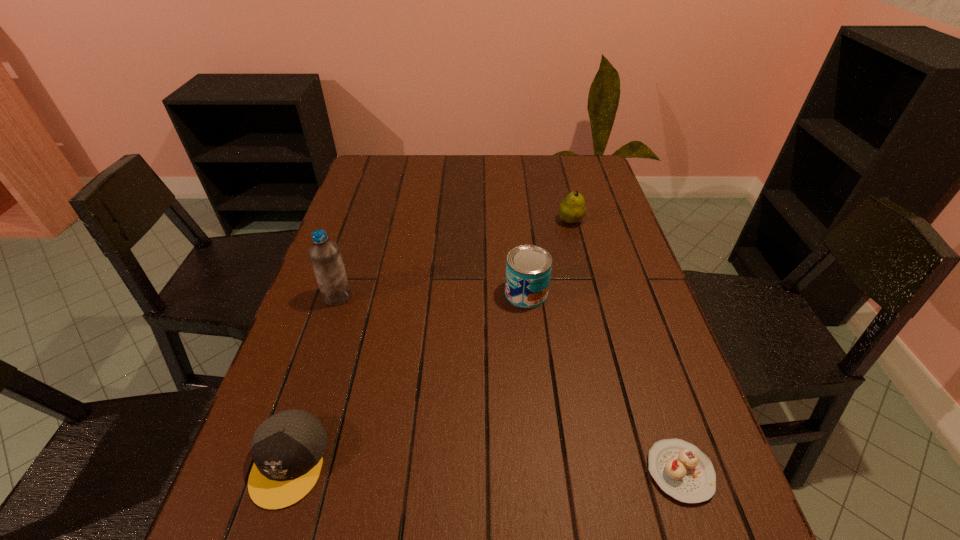
This screenshot has height=540, width=960. Find the location of `cap that is at the left edge`. cap that is at the left edge is located at coordinates (287, 448).

You are a GUI agent. You are given a task and a screenshot of the screen. Output one action in this format:
    pyautogui.click(x=<x>, y=<y>)
    Task: Click on the pear located in the right edge section of the desktop
    
    Given the screenshot: What is the action you would take?
    pyautogui.click(x=572, y=209)

Identify the location of cupcake that is at the right edge. (681, 470).

The image size is (960, 540). I want to click on vacant space at the far edge of the desktop, so click(441, 159).

At what (x,y) coordinates should I click in order to perform the action: click on vacant space at the left edge of the desktop. Please return your answer as a coordinate pair (x, y). The width and height of the screenshot is (960, 540). Looking at the image, I should click on (288, 388).

The image size is (960, 540). I want to click on vacant region at the right edge, so click(x=718, y=460).

The width and height of the screenshot is (960, 540). In order to click on vacant space at the far left corner of the desktop in this screenshot , I will do `click(376, 181)`.

This screenshot has width=960, height=540. In the image, there is a desktop. Identify the location of free space at the far right corner. (596, 163).

Locate an element on the screen. The width and height of the screenshot is (960, 540). free area in between the shortest object and the third object from right to left is located at coordinates (603, 382).

The height and width of the screenshot is (540, 960). Identify the location of free space between the pear and the water bottle. (454, 259).